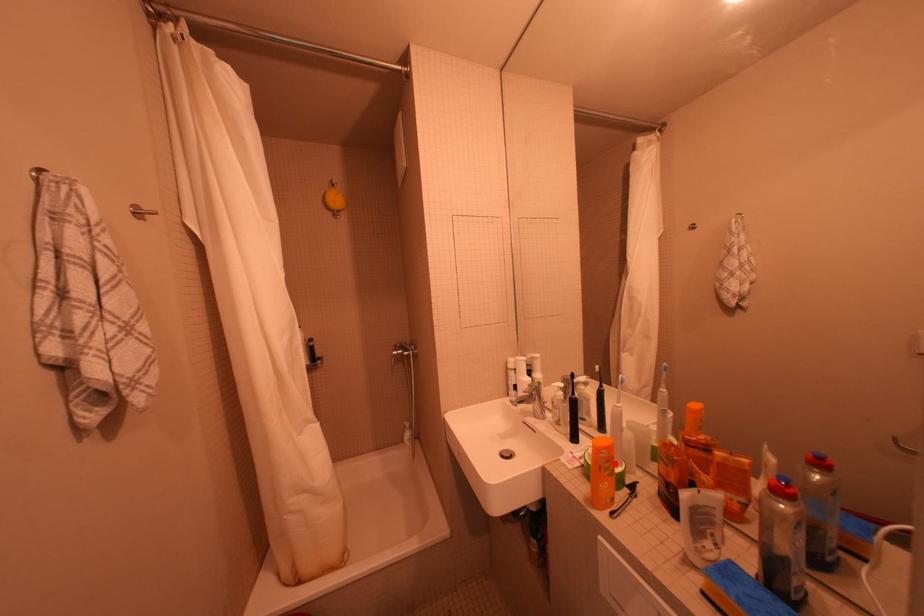
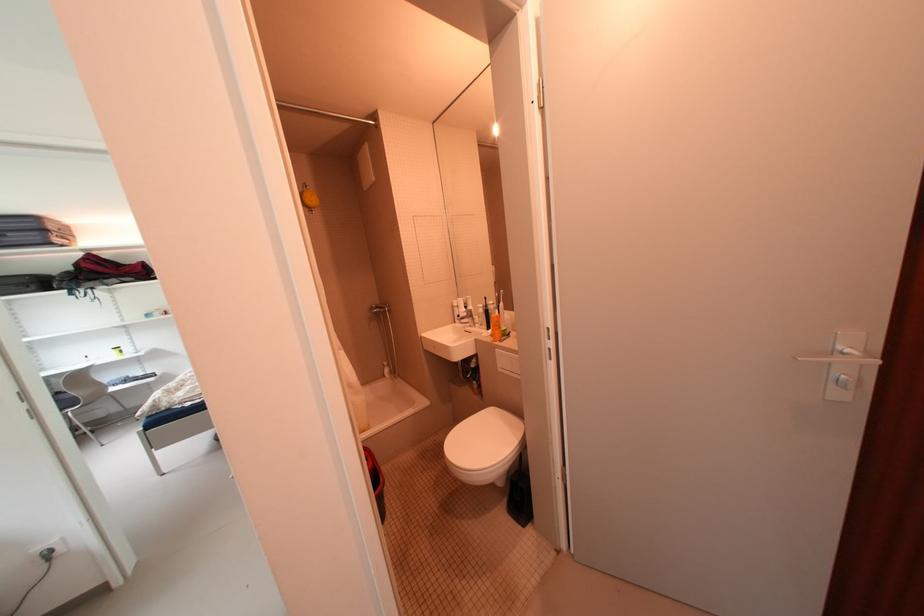
Where in the second image is the point corresponding to the highlighted location from the first image?

(505, 323)